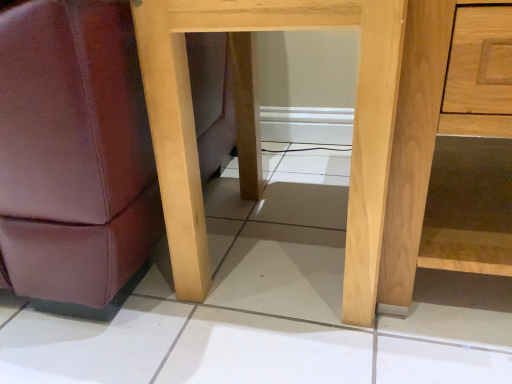
Identify the location of blank area beneath natural wood table at center (from a real-world perspective). (287, 243).